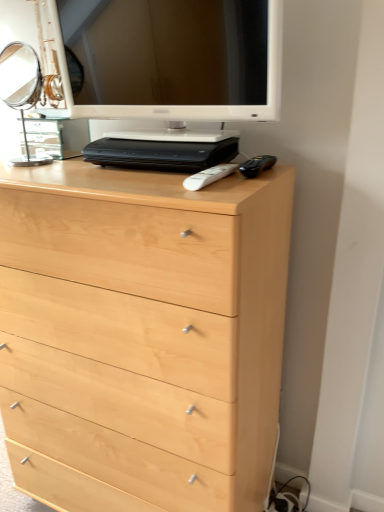
Question: Does white glossy computer monitor at upper center appear on the right side of white plastic remote at center?

Choices:
 (A) yes
 (B) no

Answer: (B)

Question: Is white glossy computer monitor at upper center shorter than white plastic remote at center?

Choices:
 (A) yes
 (B) no

Answer: (B)

Question: From the image's perspective, is white glossy computer monitor at upper center over white plastic remote at center?

Choices:
 (A) no
 (B) yes

Answer: (B)

Question: Can you confirm if white glossy computer monitor at upper center is wider than white plastic remote at center?

Choices:
 (A) no
 (B) yes

Answer: (A)

Question: Is white glossy computer monitor at upper center taller than white plastic remote at center?

Choices:
 (A) yes
 (B) no

Answer: (A)

Question: Based on their sizes in the image, would you say light wood chest of drawers at center is bigger or smaller than white plastic remote at center?

Choices:
 (A) big
 (B) small

Answer: (A)

Question: Is light wood chest of drawers at center in front of or behind white plastic remote at center in the image?

Choices:
 (A) behind
 (B) front

Answer: (B)

Question: Is light wood chest of drawers at center wider or thinner than white plastic remote at center?

Choices:
 (A) wide
 (B) thin

Answer: (A)

Question: Is light wood chest of drawers at center taller or shorter than white plastic remote at center?

Choices:
 (A) tall
 (B) short

Answer: (A)

Question: Considering the positions of point (109, 496) and point (13, 101), is point (109, 496) closer or farther from the camera than point (13, 101)?

Choices:
 (A) farther
 (B) closer

Answer: (B)

Question: Is light wood chest of drawers at center in front of or behind polished silver mirror at upper left in the image?

Choices:
 (A) front
 (B) behind

Answer: (A)

Question: In terms of width, does light wood chest of drawers at center look wider or thinner when compared to polished silver mirror at upper left?

Choices:
 (A) wide
 (B) thin

Answer: (A)

Question: Would you say light wood chest of drawers at center is to the left or to the right of polished silver mirror at upper left in the picture?

Choices:
 (A) left
 (B) right

Answer: (B)

Question: Visually, is polished silver mirror at upper left positioned to the left or to the right of light wood chest of drawers at center?

Choices:
 (A) left
 (B) right

Answer: (A)

Question: From a real-world perspective, relative to light wood chest of drawers at center, is polished silver mirror at upper left vertically above or below?

Choices:
 (A) above
 (B) below

Answer: (A)